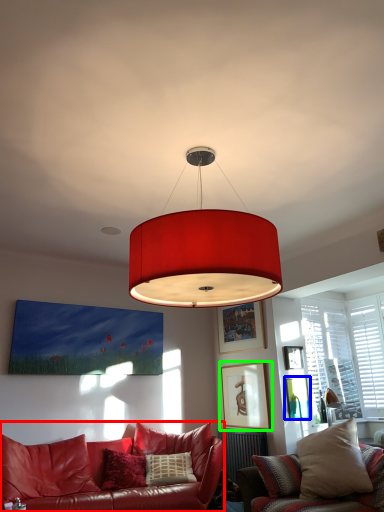
Question: Which object is the farthest from studio couch (highlighted by a red box)? Choose among these: picture frame (highlighted by a blue box) or picture frame (highlighted by a green box).

Choices:
 (A) picture frame
 (B) picture frame

Answer: (A)